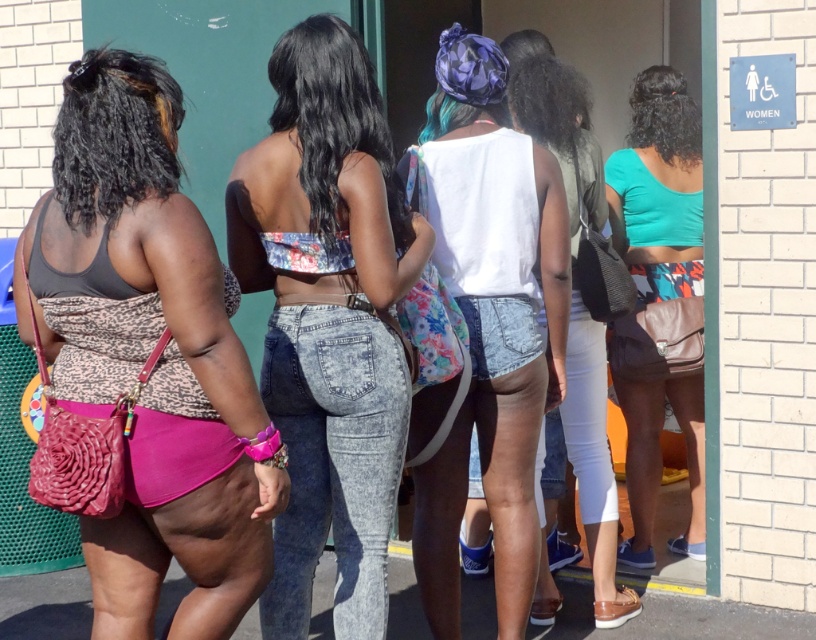
Question: Is teal matte tank top at center smaller than denim shorts at center?

Choices:
 (A) no
 (B) yes

Answer: (A)

Question: Which point is closer to the camera taking this photo?

Choices:
 (A) (633, 204)
 (B) (593, 225)
 (C) (264, 278)
 (D) (460, 106)

Answer: (C)

Question: Does leopard print purse at left have a lesser width compared to floral fabric top at center?

Choices:
 (A) no
 (B) yes

Answer: (A)

Question: Based on their relative distances, which object is nearer to the floral fabric top at center?

Choices:
 (A) white matte tank top at center
 (B) denim shorts at center
 (C) teal matte tank top at center

Answer: (A)

Question: Where is floral fabric top at center located in relation to white matte tank top at center in the image?

Choices:
 (A) above
 (B) below

Answer: (A)

Question: Which object is the farthest from the denim shorts at center?

Choices:
 (A) white matte tank top at center
 (B) teal matte tank top at center

Answer: (A)